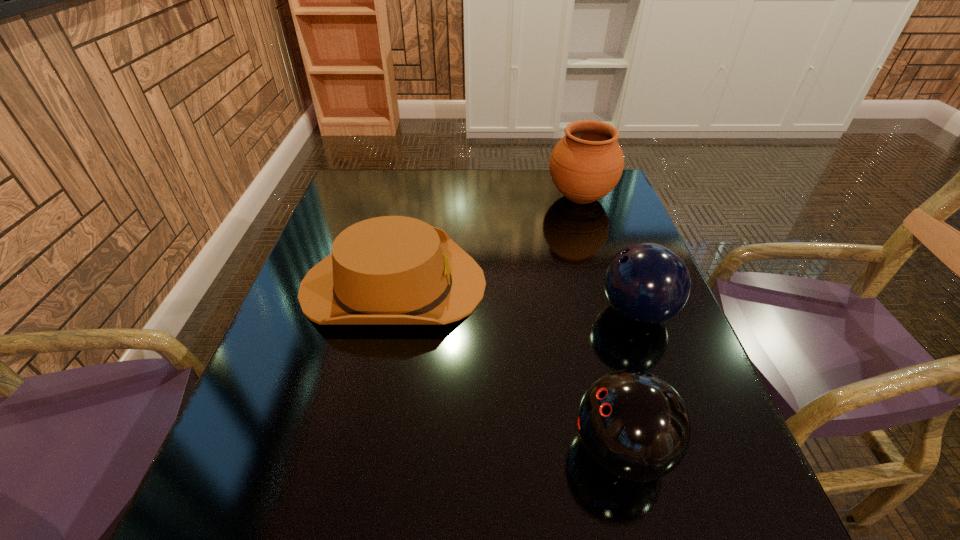
Where is `pottery`? The width and height of the screenshot is (960, 540). pottery is located at coordinates (586, 164).

The height and width of the screenshot is (540, 960). Identify the location of the tallest object. (586, 164).

The width and height of the screenshot is (960, 540). What are the coordinates of `the farther bowling ball` in the screenshot? It's located at (647, 283).

Where is `the nearer bowling ball`? Image resolution: width=960 pixels, height=540 pixels. the nearer bowling ball is located at coordinates (634, 425).

The height and width of the screenshot is (540, 960). In order to click on the shortest object in this screenshot , I will do `click(391, 270)`.

Where is `the leftmost object`? The height and width of the screenshot is (540, 960). the leftmost object is located at coordinates (391, 270).

Image resolution: width=960 pixels, height=540 pixels. In order to click on vacant space located 0.140m on the left of the tallest object in this screenshot , I will do `click(500, 198)`.

Locate an element on the screen. The image size is (960, 540). free region located on the surface of the farther bowling ball near the finger holes is located at coordinates (426, 312).

Where is `vacant area situated on the surface of the farther bowling ball near the finger holes`? This screenshot has height=540, width=960. vacant area situated on the surface of the farther bowling ball near the finger holes is located at coordinates (521, 312).

The height and width of the screenshot is (540, 960). I want to click on vacant area situated on the surface of the farther bowling ball near the finger holes, so click(476, 312).